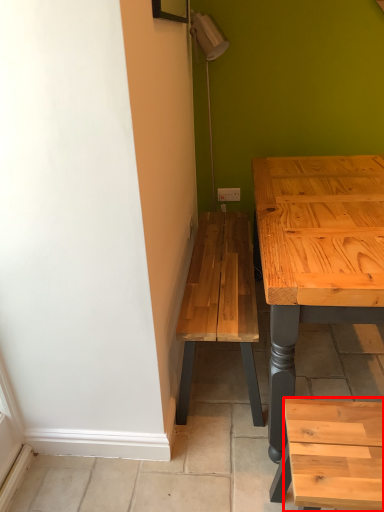
Question: From the image's perspective, where is stool (annotated by the red box) located relative to electric outlet?

Choices:
 (A) below
 (B) above

Answer: (A)